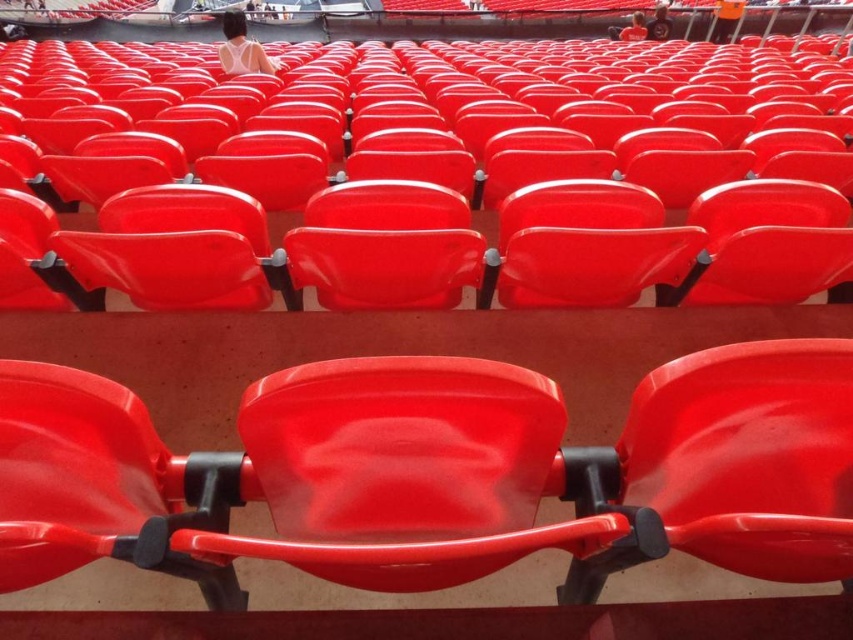
From the picture: You are standing in the stadium looking at the rows of red plastic seats. There are two points marked on the seats, point (339,134) and point (225,56). Which point is closer to you?

Point (339,134) is closer to the viewer than point (225,56).

You are standing in the stadium looking at the seats. There are two points marked on the seats at coordinates point (236, 44) and point (637, 13). Which point is closer to you?

Point (236, 44) is closer to the camera than point (637, 13).

You are sitting in the stadium and want to find someone wearing a matte white tank top at upper center. Based on the arrangement of the seats, where should you look relative to the matte plastic seat at center?

You should look above the matte plastic seat at center because the matte white tank top at upper center is located above it.